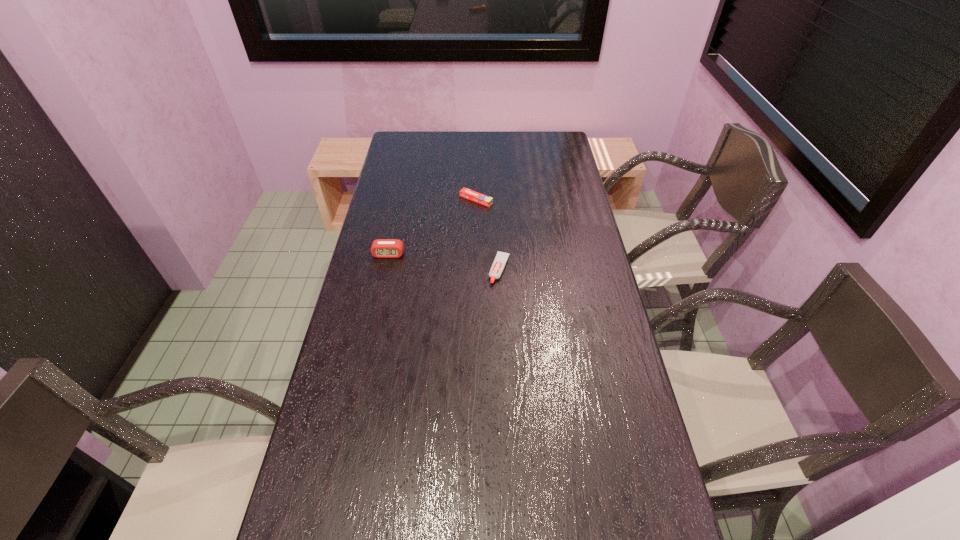
Identify the location of free region at the far edge. This screenshot has height=540, width=960. (487, 131).

The height and width of the screenshot is (540, 960). Find the location of `vacant space at the left edge`. vacant space at the left edge is located at coordinates (385, 178).

Locate an element on the screen. The height and width of the screenshot is (540, 960). free space at the right edge of the desktop is located at coordinates (579, 262).

Image resolution: width=960 pixels, height=540 pixels. In order to click on vacant region at the far left corner of the desktop in this screenshot , I will do `click(417, 155)`.

Where is `free spot between the second shortest object and the tallest object`? Image resolution: width=960 pixels, height=540 pixels. free spot between the second shortest object and the tallest object is located at coordinates (444, 262).

Find the location of `empty space that is in between the taller toothpaste and the farther toothpaste`. empty space that is in between the taller toothpaste and the farther toothpaste is located at coordinates (488, 234).

At what (x,y) coordinates should I click in order to perform the action: click on free spot between the farther toothpaste and the leftmost object. Please return your answer as a coordinate pair (x, y). Image resolution: width=960 pixels, height=540 pixels. Looking at the image, I should click on (432, 227).

You are a GUI agent. You are given a task and a screenshot of the screen. Output one action in this format:
    pyautogui.click(x=<x>, y=<y>)
    Task: Click on the free space that is in between the leftmost object and the farthest object
    
    Given the screenshot: What is the action you would take?
    pyautogui.click(x=432, y=227)

Locate an element on the screen. Image resolution: width=960 pixels, height=540 pixels. empty location between the farther toothpaste and the second shortest object is located at coordinates (488, 234).

This screenshot has height=540, width=960. In order to click on empty space that is in between the farther toothpaste and the nearer toothpaste in this screenshot , I will do `click(488, 234)`.